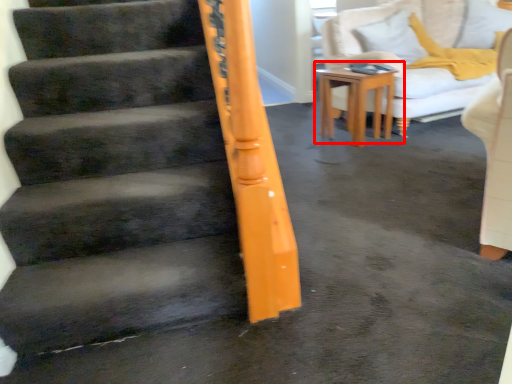
Question: In this image, where is table (annotated by the red box) located relative to pillow?

Choices:
 (A) right
 (B) left

Answer: (B)